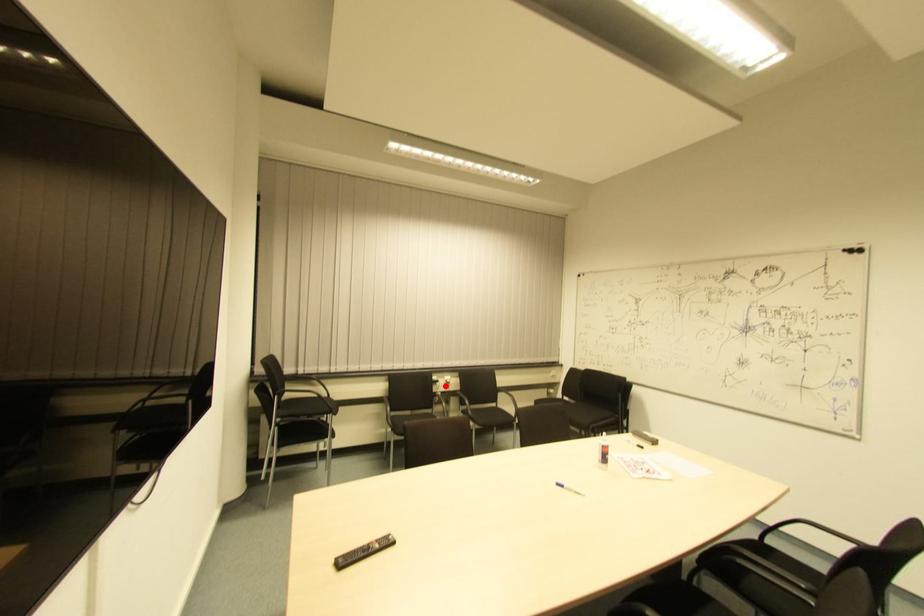
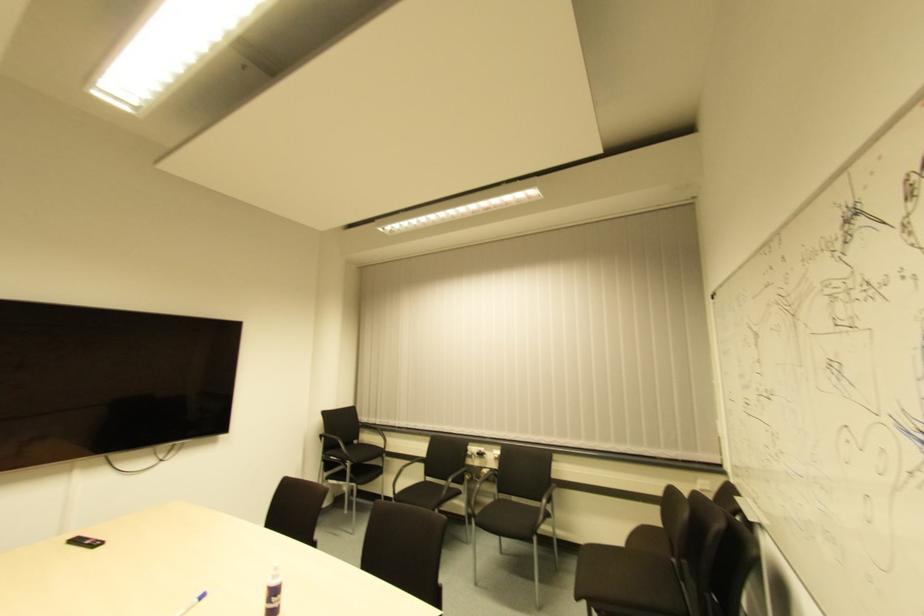
Question: I am providing you with two images of the same scene from different viewpoints. In image1, a red point is highlighted. Considering the same 3D point in image2, which of the following is correct?

Choices:
 (A) It is closer
 (B) It is farther

Answer: (A)